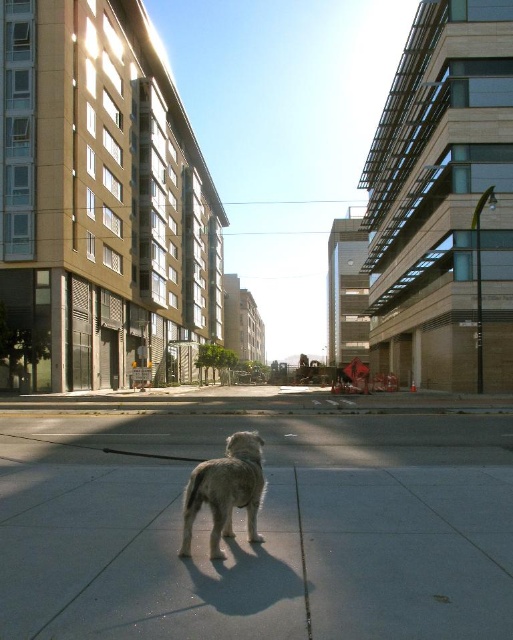
Question: Which of the following is the closest to the observer?

Choices:
 (A) (232, 452)
 (B) (384, 513)

Answer: (A)

Question: Can you confirm if gray concrete pavement at center is bigger than light brown fur dog at center?

Choices:
 (A) yes
 (B) no

Answer: (A)

Question: Which point is farther from the camera taking this photo?

Choices:
 (A) (424, 433)
 (B) (207, 484)

Answer: (A)

Question: Is gray concrete pavement at center wider than light brown fur dog at center?

Choices:
 (A) yes
 (B) no

Answer: (A)

Question: Is gray concrete pavement at center closer to the viewer compared to light brown fur dog at center?

Choices:
 (A) no
 (B) yes

Answer: (B)